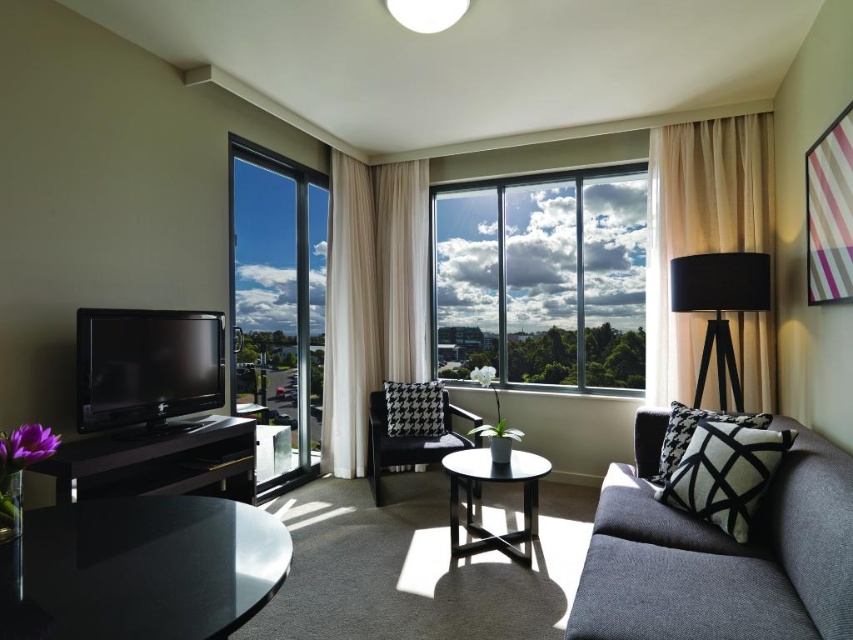
Between point (334, 164) and point (538, 470), which one is positioned in front?

Positioned in front is point (538, 470).

Between point (415, 205) and point (485, 529), which one is positioned behind?

The point (415, 205) is behind.

Find the location of a particular element. beige fabric curtain at center is located at coordinates (370, 298).

Is point (144, 429) positioned in front of point (160, 484)?

No, (144, 429) is behind (160, 484).

Is point (144, 372) less distant than point (135, 433)?

No, (144, 372) is further to viewer.

Find the location of a particular element. matte black flat screen tv at left is located at coordinates (146, 365).

Measure the distance between point (x=457, y=189) and camera.

5.05 meters

Does clear glass window at center have a lesser width compared to transparent glass window at left?

No, clear glass window at center is not thinner than transparent glass window at left.

I want to click on clear glass window at center, so click(543, 276).

Locate an element on the screen. clear glass window at center is located at coordinates (543, 276).